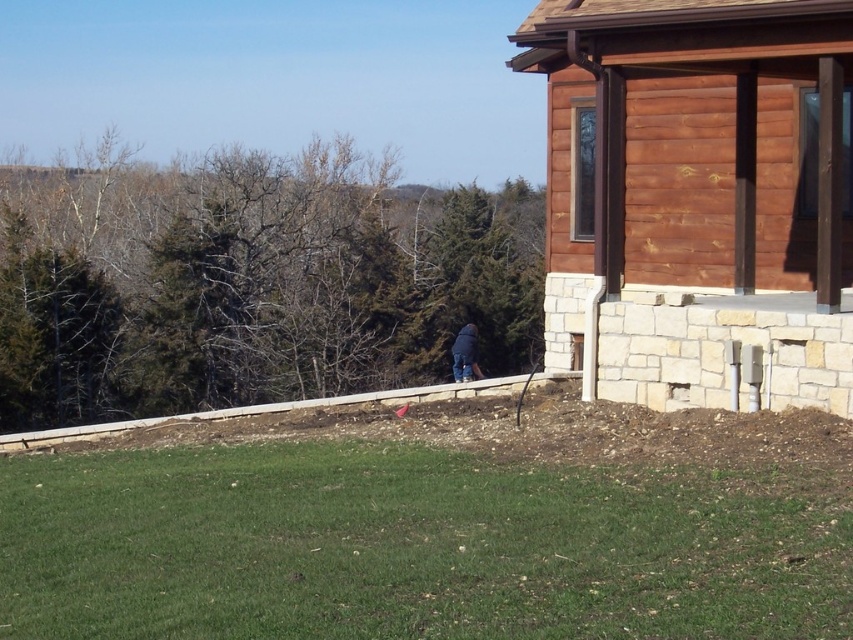
You are standing in front of the wooden cabin and looking at two points marked in the scene. Which point, point (454,577) or point (461,333), is closer to you?

Point (454,577) is closer to the camera than point (461,333), so it is closer to you.

You are standing in the rural outdoor scene and see the green grass at lower center and the dark blue fabric at center. Which object takes up more space in the image?

The dark blue fabric at center takes up more space in the image because it is larger than the green grass at lower center.